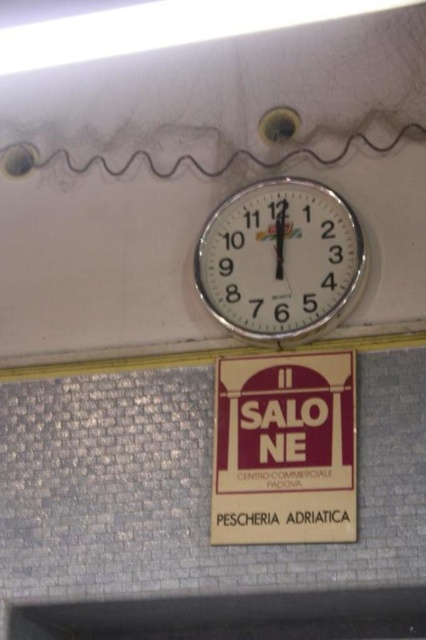
Based on the photo, you are an interior designer assessing the wall layout. You need to determine if the matte brown sign at center can be placed to the right of the metallic clock at upper center without overlapping. Can it fit horizontally?

The matte brown sign at center has a lesser width compared to metallic clock at upper center. Since the sign is narrower, it can fit to the right of the clock without overlapping as long as there is enough horizontal space available on the wall.

You are standing in front of a wall with a clock and a signboard. You need to place a new decorative item between the matte brown sign at center and the metallic clock at upper center. Given that the distance between them is 4.81 meters, can you estimate how much space you have to work with for placing the item?

The distance between the matte brown sign at center and the metallic clock at upper center is 4.81 meters, so you have approximately 4.81 meters of space to work with for placing the new decorative item between them.

Based on the photo, you are standing in front of a wall with a matte brown sign at center and a metallic clock at upper center. Which object is taller?

The metallic clock at upper center is taller than the matte brown sign at center.